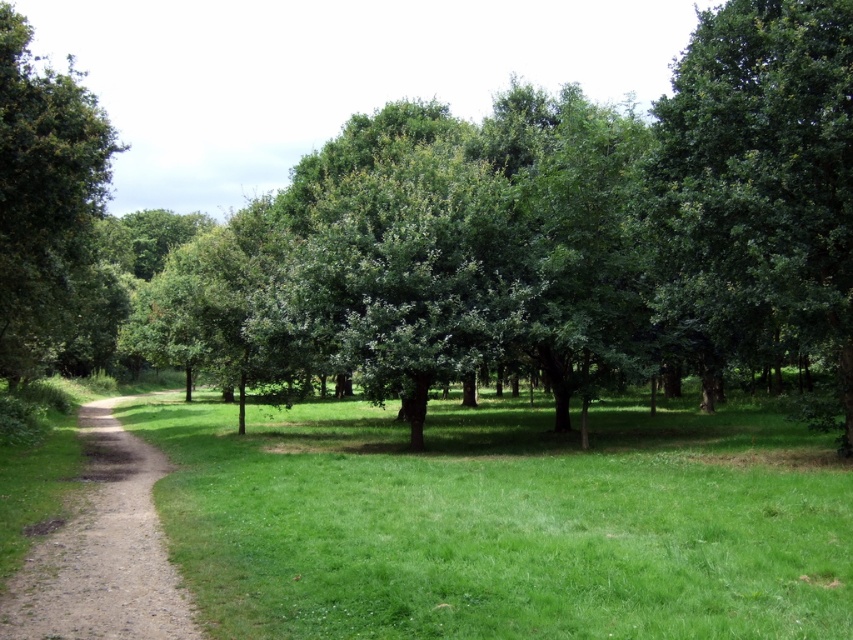
You are planning to set up a small tent in the park. Based on the image, which area would be more suitable for the tent between the green grassy field at center and the green leafy tree at right? Explain your choice using the scene details.

The green grassy field at center is shorter than the green leafy tree at right, so the green grassy field at center would be more suitable for setting up the tent as it offers a flat and open space without obstruction from the taller tree.